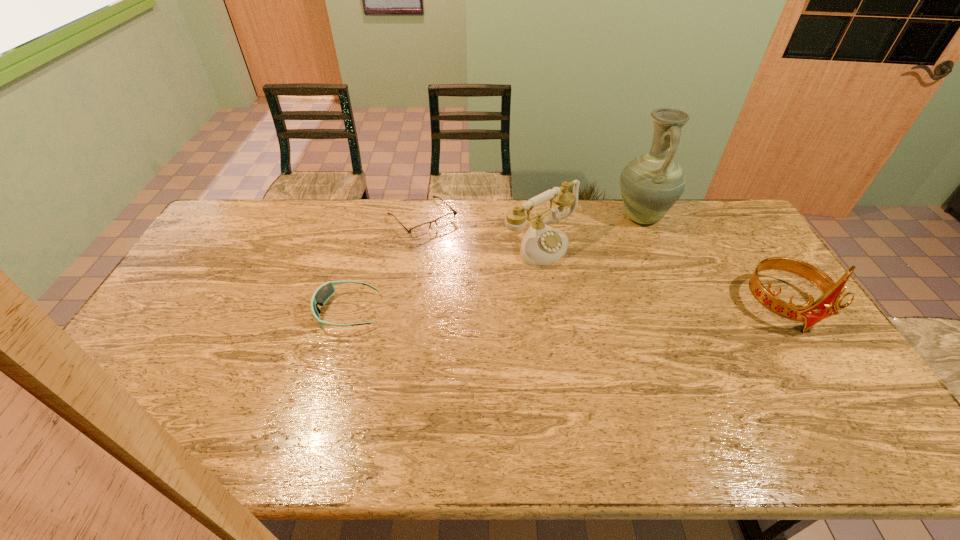
This screenshot has width=960, height=540. I want to click on vacant space that is in between the goggles and the fourth shortest object, so click(x=566, y=309).

Where is `object identified as the closest to the shortest object`? The height and width of the screenshot is (540, 960). object identified as the closest to the shortest object is located at coordinates (541, 245).

I want to click on the fourth closest object to the pitcher, so click(x=324, y=292).